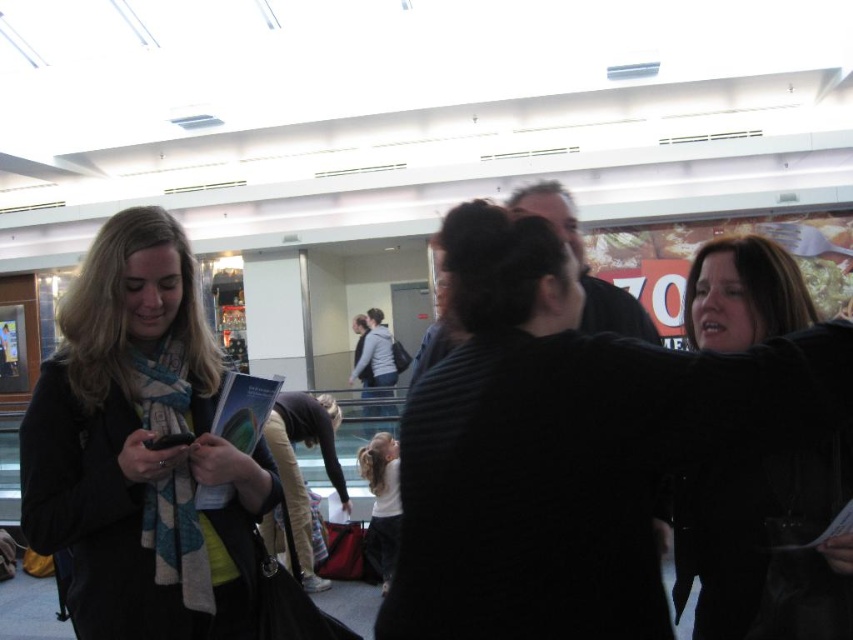
Between point (41, 534) and point (842, 625), which one is positioned in front?

Positioned in front is point (842, 625).

Is point (177, 307) more distant than point (793, 291)?

That is True.

This screenshot has width=853, height=640. In order to click on black matte scarf at left in this screenshot , I will do `click(140, 449)`.

Which is below, black matte scarf at left or white cotton shirt at center?

Positioned lower is white cotton shirt at center.

Does point (102, 499) come in front of point (393, 525)?

Yes, point (102, 499) is closer to viewer.

Does point (36, 541) come in front of point (390, 451)?

Yes, it is in front of point (390, 451).

Image resolution: width=853 pixels, height=640 pixels. I want to click on black matte scarf at left, so click(x=140, y=449).

Can you confirm if black fuzzy coat at right is positioned above white cotton shirt at center?

Yes.

Which is in front, point (775, 515) or point (393, 509)?

Point (775, 515) is in front.

Does point (698, 484) come farther from viewer compared to point (376, 566)?

No, (698, 484) is closer to viewer.

Identify the location of black fuzzy coat at right. The width and height of the screenshot is (853, 640). (762, 541).